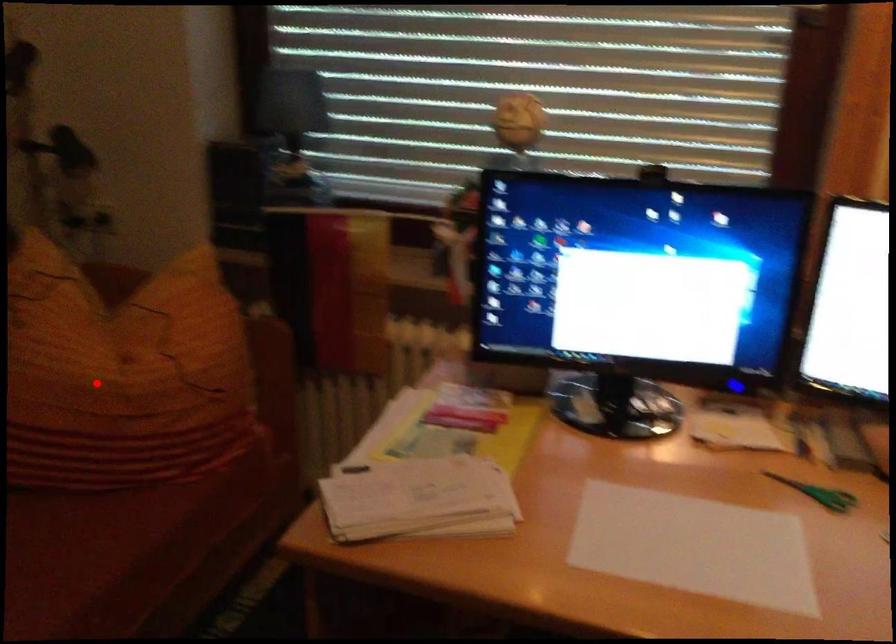
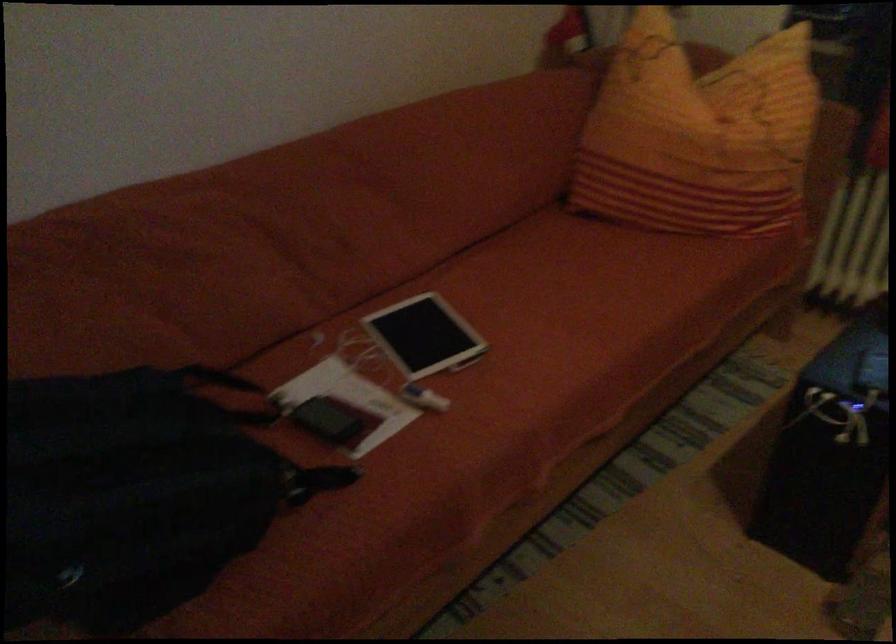
Question: I am providing you with two images of the same scene from different viewpoints. A red point is marked on the first image. At the location where the point appears in image 1, is it still visible in image 2?

Choices:
 (A) Yes
 (B) No

Answer: (A)